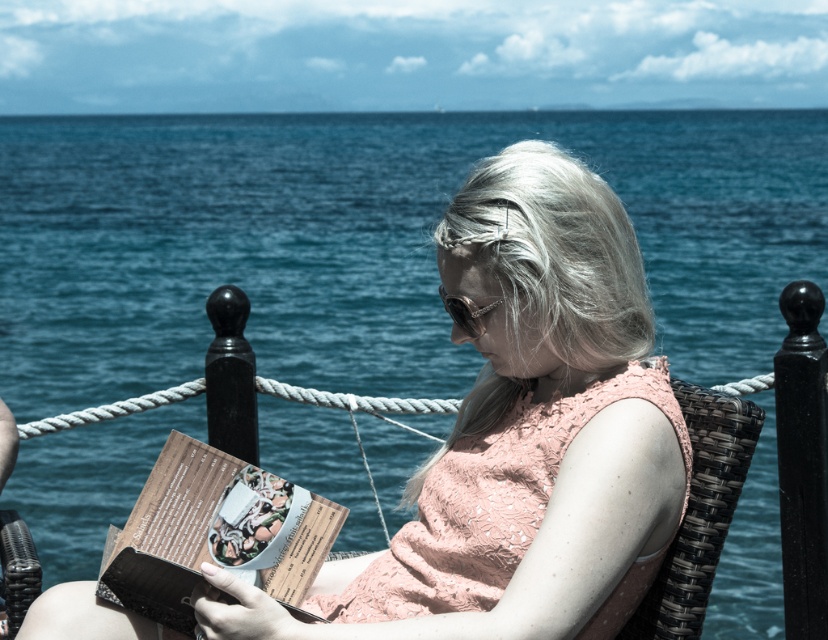
Question: Is matte brown book at center wider than woven rattan chair at center?

Choices:
 (A) no
 (B) yes

Answer: (B)

Question: Which point is farther from the camera taking this photo?

Choices:
 (A) (647, 605)
 (B) (118, 556)

Answer: (A)

Question: Which point is closer to the camera taking this photo?

Choices:
 (A) click(x=143, y=564)
 (B) click(x=723, y=512)

Answer: (A)

Question: From the image, what is the correct spatial relationship of matte brown book at center in relation to woven rattan chair at center?

Choices:
 (A) below
 (B) above

Answer: (A)

Question: From the image, what is the correct spatial relationship of matte brown book at center in relation to woven rattan chair at center?

Choices:
 (A) above
 (B) below

Answer: (B)